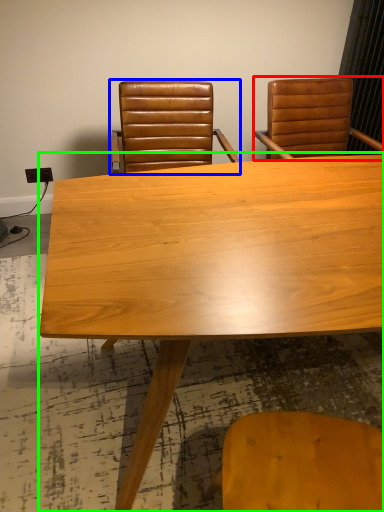
Question: Which is nearer to the chair (highlighted by a red box)? chair (highlighted by a blue box) or table (highlighted by a green box).

Choices:
 (A) chair
 (B) table

Answer: (A)